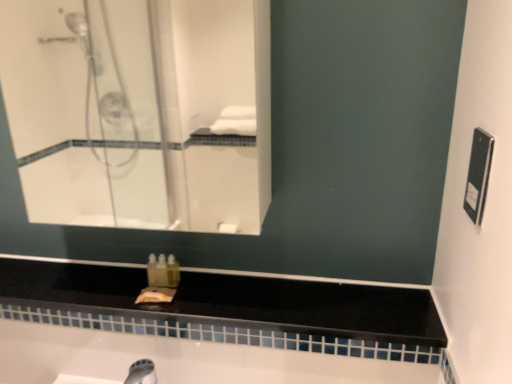
You are a GUI agent. You are given a task and a screenshot of the screen. Output one action in this format:
    pyautogui.click(x=<x>, y=<y>)
    Task: Click on the free space below white glass mirror at upper left (from a real-world perspective)
    The width and height of the screenshot is (512, 384).
    Given the screenshot: What is the action you would take?
    pyautogui.click(x=175, y=280)